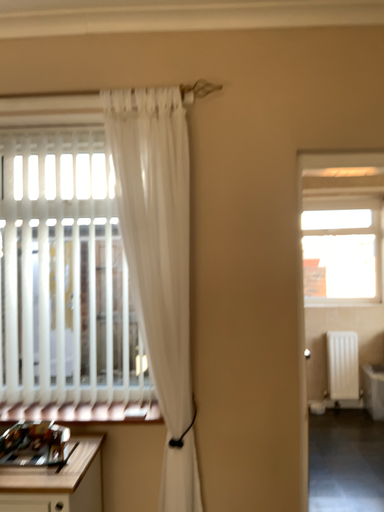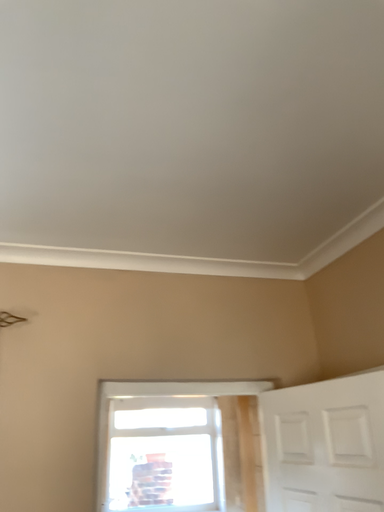
Question: How did the camera likely rotate when shooting the video?

Choices:
 (A) rotated downward
 (B) rotated upward

Answer: (B)